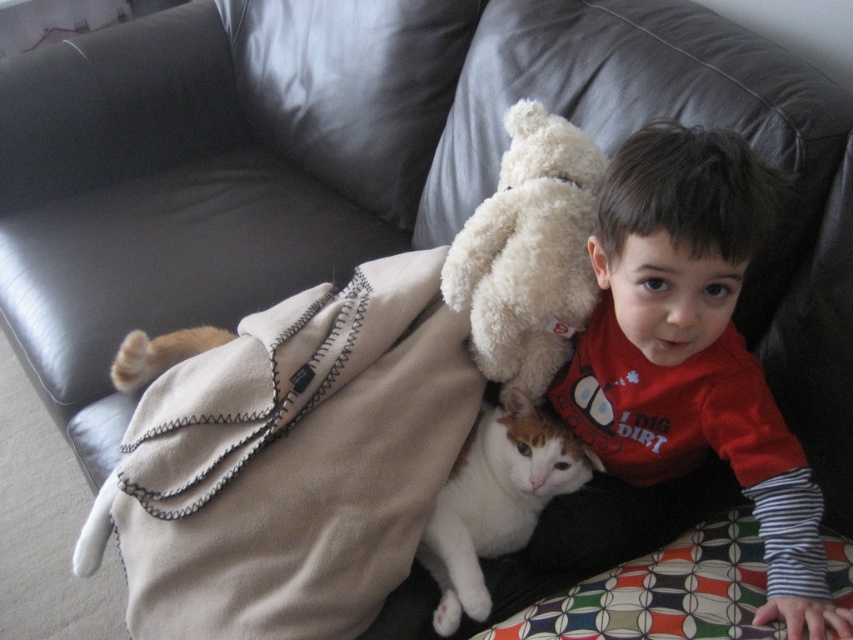
In the scene shown: Who is more forward, (219,628) or (631,262)?

Point (631,262) is more forward.

Between point (328, 532) and point (679, 420), which one is positioned behind?

Positioned behind is point (679, 420).

The height and width of the screenshot is (640, 853). In order to click on beige fleece blanket at upper left in this screenshot , I will do `click(294, 461)`.

Between beige fleece blanket at upper left and white soft fur cat at lower center, which one has more height?

beige fleece blanket at upper left is taller.

Who is higher up, beige fleece blanket at upper left or white soft fur cat at lower center?

beige fleece blanket at upper left

You are a GUI agent. You are given a task and a screenshot of the screen. Output one action in this format:
    pyautogui.click(x=<x>, y=<y>)
    Task: Click on the beige fleece blanket at upper left
    This screenshot has height=640, width=853.
    Given the screenshot: What is the action you would take?
    pyautogui.click(x=294, y=461)

Describe the element at coordinates (688, 360) in the screenshot. This screenshot has width=853, height=640. I see `red cotton shirt at upper right` at that location.

The image size is (853, 640). I want to click on red cotton shirt at upper right, so click(x=688, y=360).